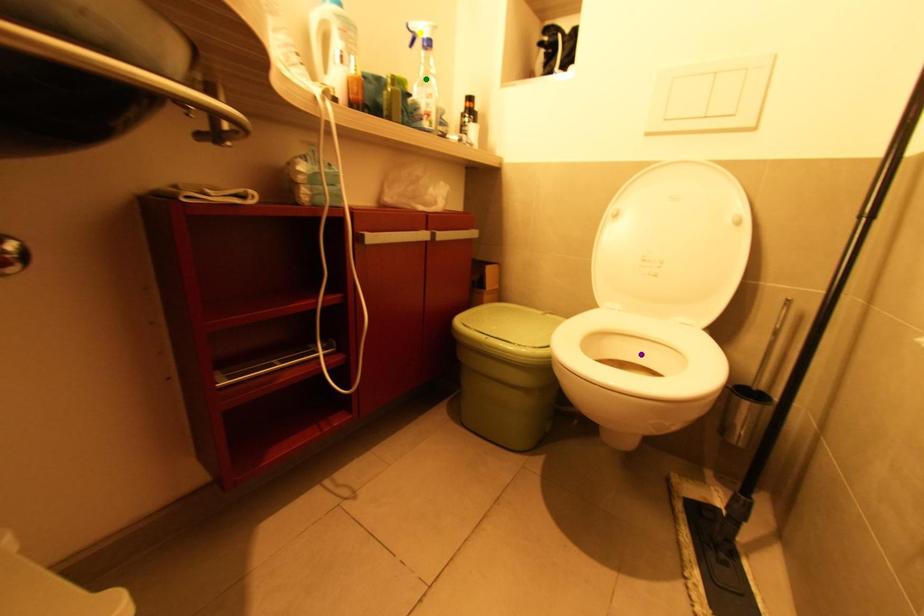
Order these from nearest to farthest:
yellow point | green point | purple point

purple point
yellow point
green point